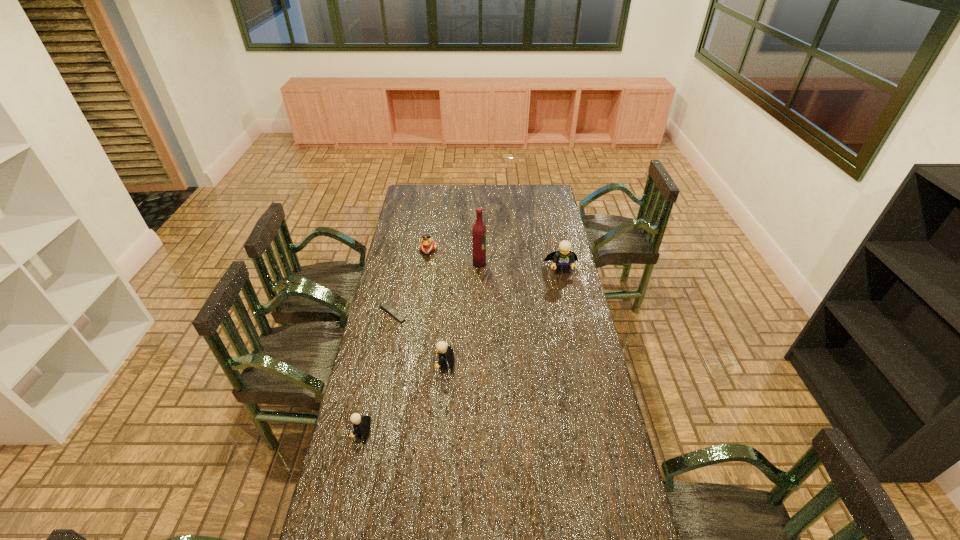
I want to click on vacant area between the fifth farthest object and the shortest Lego, so click(403, 398).

The width and height of the screenshot is (960, 540). Identify the location of free point between the farthest Lego and the shortest object. (477, 292).

Where is `free space that is in between the fifth shortest object and the fourth object from right to left`? Image resolution: width=960 pixels, height=540 pixels. free space that is in between the fifth shortest object and the fourth object from right to left is located at coordinates (494, 260).

Where is `blank region between the second Lego from right to left and the leftmost Lego`? Image resolution: width=960 pixels, height=540 pixels. blank region between the second Lego from right to left and the leftmost Lego is located at coordinates (403, 398).

This screenshot has height=540, width=960. Find the location of `empty space that is in between the shortest object and the liquor`. empty space that is in between the shortest object and the liquor is located at coordinates (436, 289).

Where is `empty space that is in between the second Lego from right to left and the rightmost Lego`? empty space that is in between the second Lego from right to left and the rightmost Lego is located at coordinates (503, 317).

Locate an element on the screen. The image size is (960, 540). empty location between the nearest object and the second nearest Lego is located at coordinates (403, 398).

Locate which object ranks third in proximity to the fifth object from left to right. Please provide its 2D coordinates. Your answer should be formatted as a tuple, i.e. [(x, y)], where the tuple contains the x and y coordinates of a point satisfying the conditions above.

[(384, 306)]

Locate which object ranks fourth in proximity to the farthest object. Please provide its 2D coordinates. Your answer should be formatted as a tuple, i.e. [(x, y)], where the tuple contains the x and y coordinates of a point satisfying the conditions above.

[(445, 352)]

Identify which Lego is located as the nearest to the leftmost Lego. Please provide its 2D coordinates. Your answer should be formatted as a tuple, i.e. [(x, y)], where the tuple contains the x and y coordinates of a point satisfying the conditions above.

[(445, 352)]